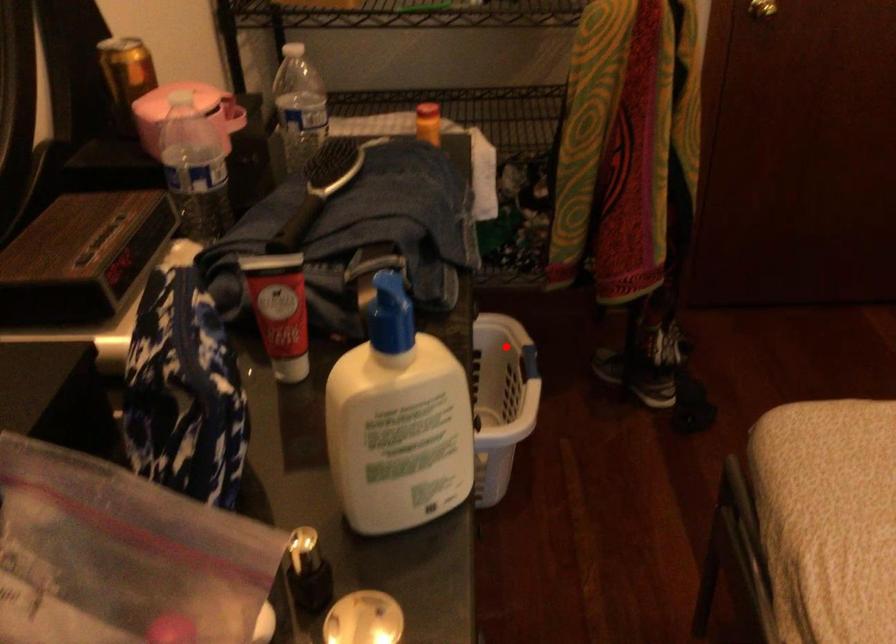
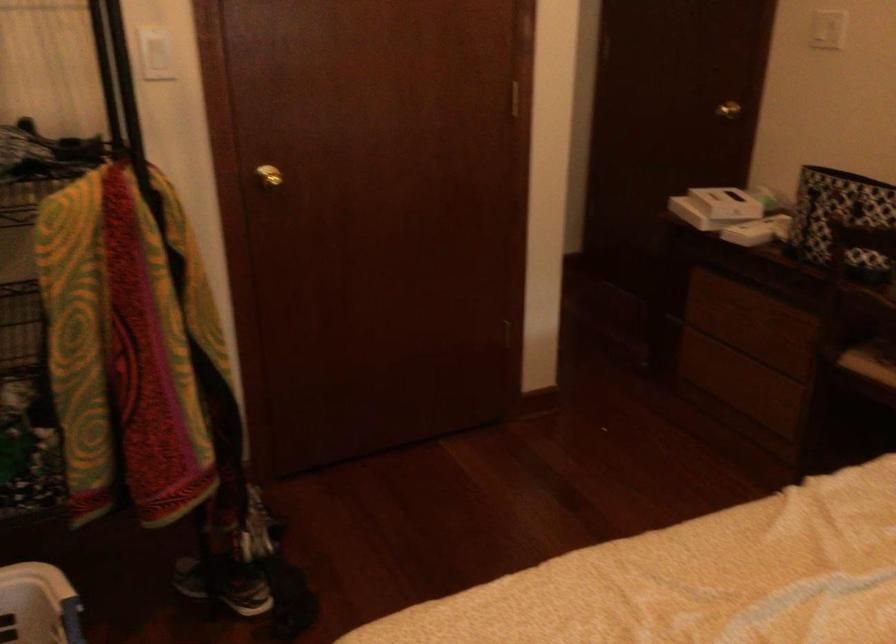
The point at the highlighted location is marked in the first image. Where is the corresponding point in the second image?

(38, 605)